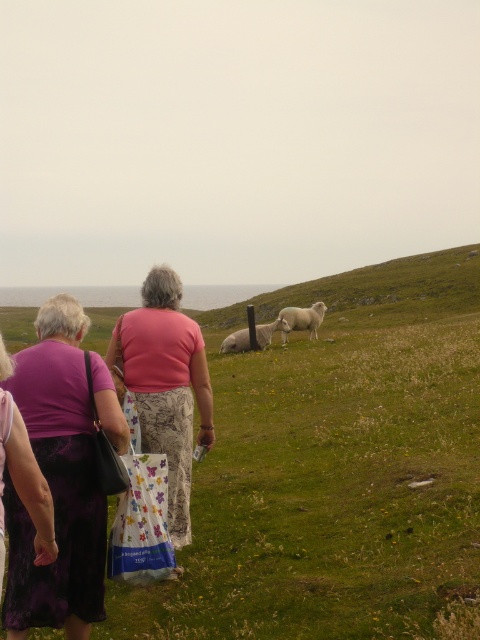
Question: Does pink fabric skirt at center have a larger size compared to purple lace dress at lower left?

Choices:
 (A) yes
 (B) no

Answer: (A)

Question: Which point appears closest to the camera in this image?

Choices:
 (A) (195, 385)
 (B) (81, 506)
 (C) (264, 348)
 (D) (298, 326)

Answer: (B)

Question: Can you confirm if white fluffy sheep at center is smaller than white woolly sheep at center?

Choices:
 (A) yes
 (B) no

Answer: (A)

Question: Which point is closer to the camera?

Choices:
 (A) (35, 509)
 (B) (165, 397)
 (C) (36, 397)

Answer: (A)

Question: In this image, where is purple lace skirt at lower left located relative to pink fabric skirt at center?

Choices:
 (A) above
 (B) below

Answer: (B)

Question: Among these points, which one is nearest to the camera?

Choices:
 (A) (14, 602)
 (B) (29, 515)
 (C) (319, 317)

Answer: (B)